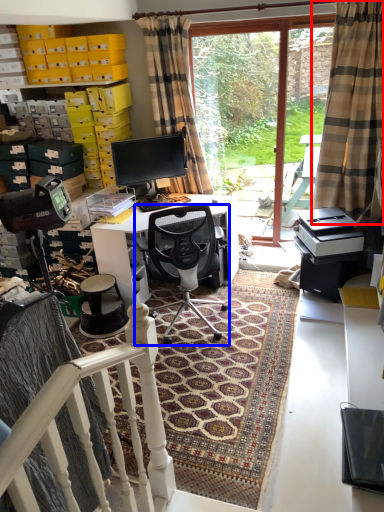
Question: Which object appears farthest to the camera in this image, curtain (highlighted by a red box) or chair (highlighted by a blue box)?

Choices:
 (A) curtain
 (B) chair

Answer: (B)